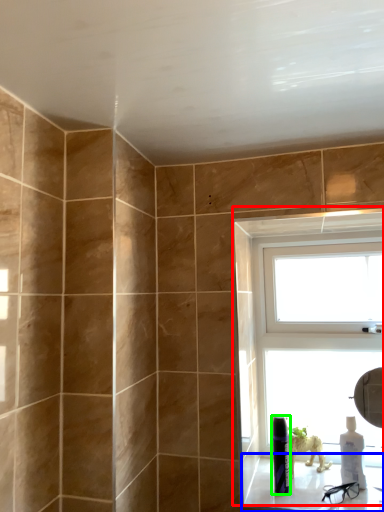
Question: Considering the real-world distances, which object is closest to window (highlighted by a red box)? window sill (highlighted by a blue box) or toiletry (highlighted by a green box).

Choices:
 (A) window sill
 (B) toiletry

Answer: (A)